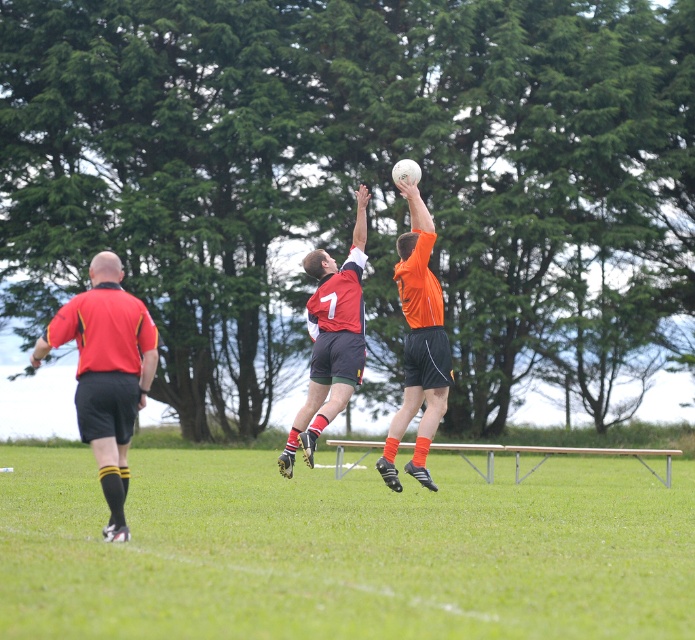
Based on the scene description, what is located at the coordinates point [343,548]?

The green grass at center is located at point 0.8559, 0.495.

You are a photographer trying to capture the Gaelic football match. You notice the green grass at center and the matte red shirt at left in your frame. Which object appears closer to the camera based on their relative heights in the image?

The matte red shirt at left appears closer to the camera because it has a greater height than the green grass at center in the image.

You are a sports analyst watching the Gaelic football match. You notice the red jersey at center and the metallic silver rail at center. Which object appears larger in the image?

The metallic silver rail at center appears larger because the red jersey at center is smaller than it.